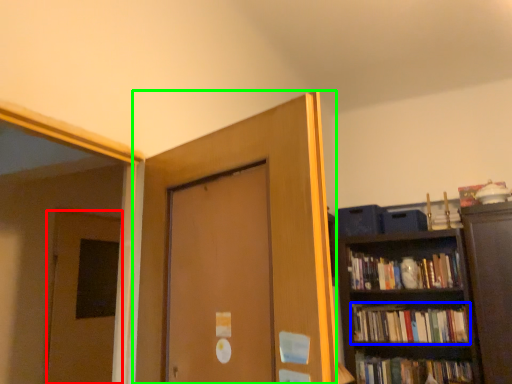
Question: Based on their relative distances, which object is nearer to door (highlighted by a red box)? Choose from book (highlighted by a blue box) and door (highlighted by a green box).

Choices:
 (A) book
 (B) door

Answer: (B)